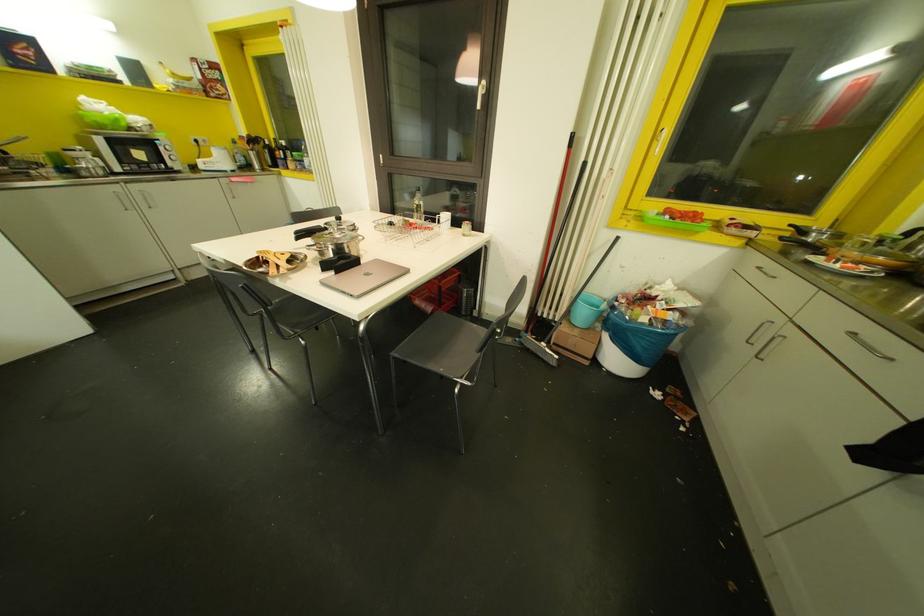
Where would you lift the pot lid handle? Please return your answer as a coordinate pair (x, y).

(336, 213)